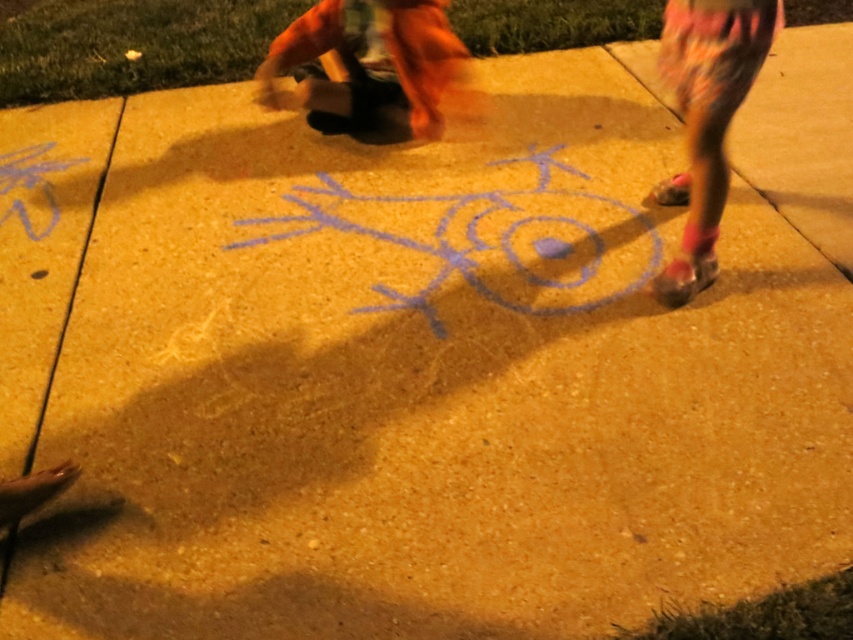
Based on the photo, does blue chalk drawing at center have a lesser height compared to floral leggings at right?

Correct, blue chalk drawing at center is not as tall as floral leggings at right.

Is blue chalk drawing at center below floral leggings at right?

Yes, blue chalk drawing at center is below floral leggings at right.

Between point (471, 275) and point (677, 296), which one is positioned behind?

Positioned behind is point (471, 275).

Identify the location of blue chalk drawing at center. The width and height of the screenshot is (853, 640). (492, 240).

Does orange fabric pants at upper center have a smaller size compared to floral leggings at right?

Incorrect, orange fabric pants at upper center is not smaller in size than floral leggings at right.

Is orange fabric pants at upper center further to the viewer compared to floral leggings at right?

Yes.

Between point (381, 13) and point (718, 148), which one is positioned in front?

Positioned in front is point (718, 148).

This screenshot has height=640, width=853. In order to click on orange fabric pants at upper center in this screenshot , I will do (x=374, y=65).

Between blue chalk drawing at center and orange fabric pants at upper center, which one appears on the right side from the viewer's perspective?

blue chalk drawing at center

The width and height of the screenshot is (853, 640). What are the coordinates of `blue chalk drawing at center` in the screenshot? It's located at [492, 240].